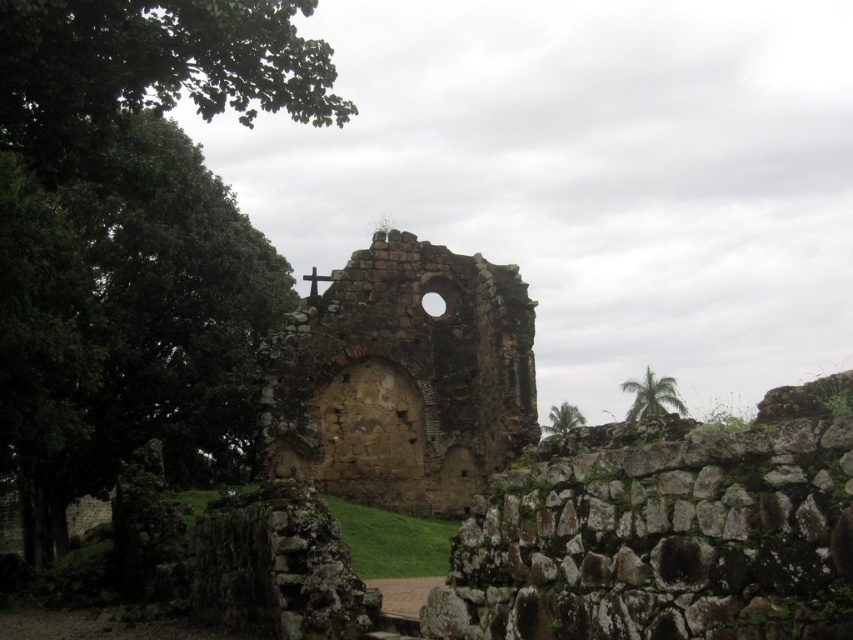
Looking at this image, can you confirm if green leafy tree at upper left is bigger than brown stone ruins at center?

Indeed, green leafy tree at upper left has a larger size compared to brown stone ruins at center.

Is point (10, 76) farther from viewer compared to point (344, 461)?

No, (10, 76) is closer to viewer.

This screenshot has height=640, width=853. Find the location of `green leafy tree at upper left`. green leafy tree at upper left is located at coordinates (134, 237).

Based on the photo, is green leafy palm at upper right closer to the viewer compared to green leafy tree at upper right?

No, green leafy palm at upper right is behind green leafy tree at upper right.

Does point (645, 387) come in front of point (561, 435)?

Yes, it is in front of point (561, 435).

The height and width of the screenshot is (640, 853). In order to click on green leafy palm at upper right in this screenshot , I will do `click(653, 396)`.

What do you see at coordinates (134, 237) in the screenshot?
I see `green leafy tree at upper left` at bounding box center [134, 237].

Can you confirm if green leafy tree at upper left is positioned below green leafy palm at upper right?

No, green leafy tree at upper left is not below green leafy palm at upper right.

Who is more distant from viewer, [97,259] or [642,396]?

The point [642,396] is behind.

Image resolution: width=853 pixels, height=640 pixels. I want to click on green leafy tree at upper left, so pos(134,237).